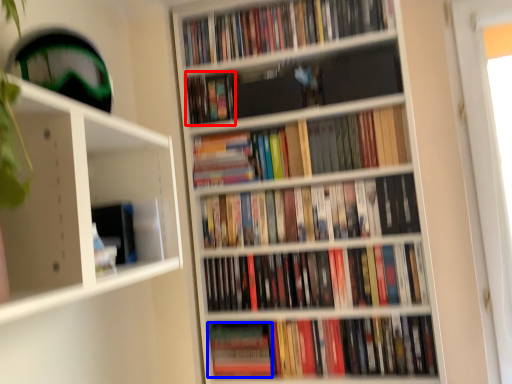
Question: Which of the following is the farthest to the observer, book (highlighted by a red box) or paperback book (highlighted by a blue box)?

Choices:
 (A) book
 (B) paperback book

Answer: (A)